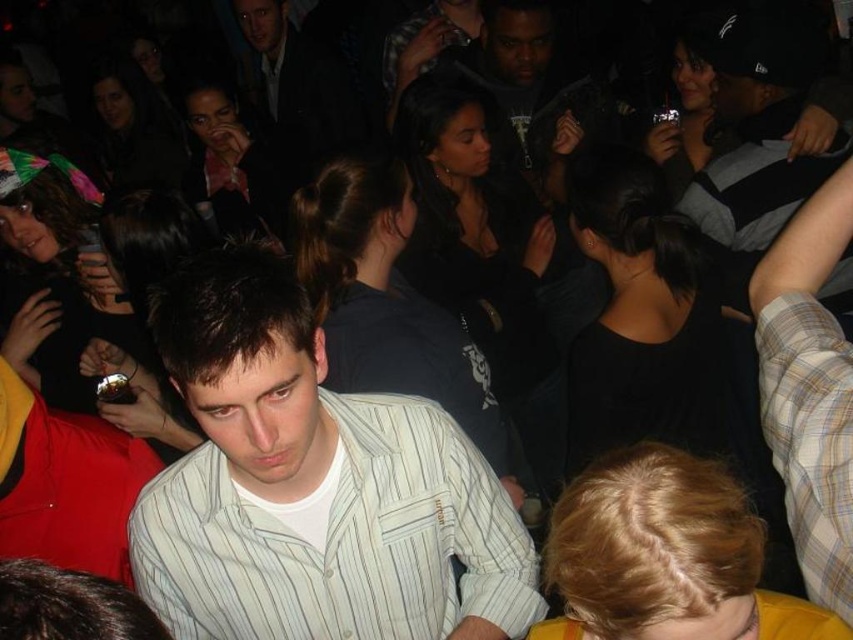
You are a security guard at the venue and need to ensure that the distance between the white striped shirt at center and the striped shirt at upper right is at least 1.5 meters for crowd control purposes. Is the current distance sufficient?

The white striped shirt at center is 1.64 meters away from the striped shirt at upper right, which exceeds the required 1.5 meters, so the distance is sufficient for crowd control purposes.

You are at a social event and need to move from your current position to the exit located at point (730, 124). There is an obstacle at point (483, 531). Will you have to go around the obstacle to reach the exit?

Yes, you will have to go around the obstacle at point (483, 531) because it is in front of the exit at point (730, 124).

Consider the image. You are organizing a clothing donation drive and need to determine which of the two striped shirts can fit into a standard donation box that accommodates items up to 30 inches in width. Given the white striped shirt at center and the striped shirt at upper right, which one is more likely to fit?

The striped shirt at upper right is narrower than the white striped shirt at center, so the striped shirt at upper right is more likely to fit into the donation box since its width is under 30 inches.